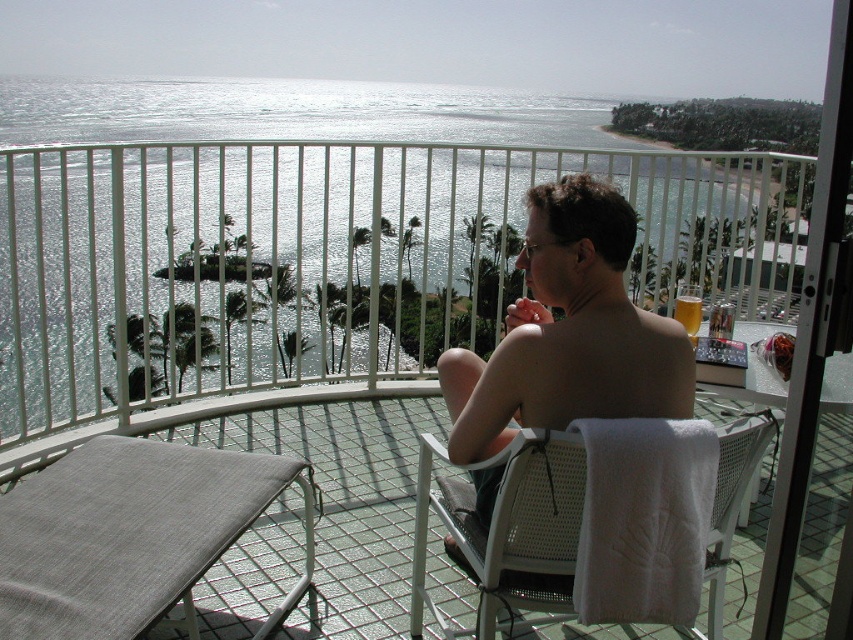
Question: Does white woven chair at center appear over translucent glass beverage at upper right?

Choices:
 (A) yes
 (B) no

Answer: (B)

Question: Does gray fabric chair at lower left appear on the right side of shiny silver phone at center?

Choices:
 (A) no
 (B) yes

Answer: (A)

Question: Among these objects, which one is farthest from the camera?

Choices:
 (A) gray fabric chair at lower left
 (B) shiny silver phone at center

Answer: (B)

Question: Among these points, which one is farthest from the camera?

Choices:
 (A) (683, 310)
 (B) (35, 586)
 (C) (544, 502)
 (D) (490, 449)

Answer: (A)

Question: Is shiny silver phone at center thinner than translucent glass beverage at upper right?

Choices:
 (A) no
 (B) yes

Answer: (A)

Question: Which object is positioned farthest from the translucent glass beverage at upper right?

Choices:
 (A) shiny silver phone at center
 (B) gray fabric chair at lower left
 (C) white woven chair at center

Answer: (B)